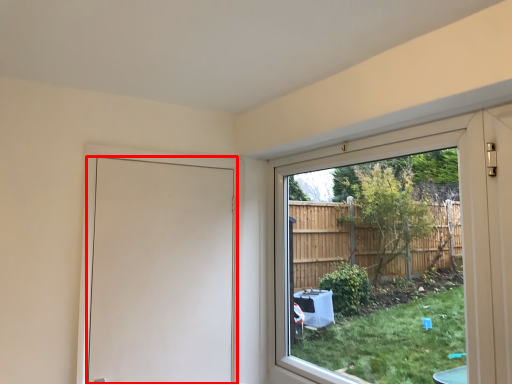
Question: From the image, what is the correct spatial relationship of door (annotated by the red box) in relation to window?

Choices:
 (A) right
 (B) left

Answer: (B)